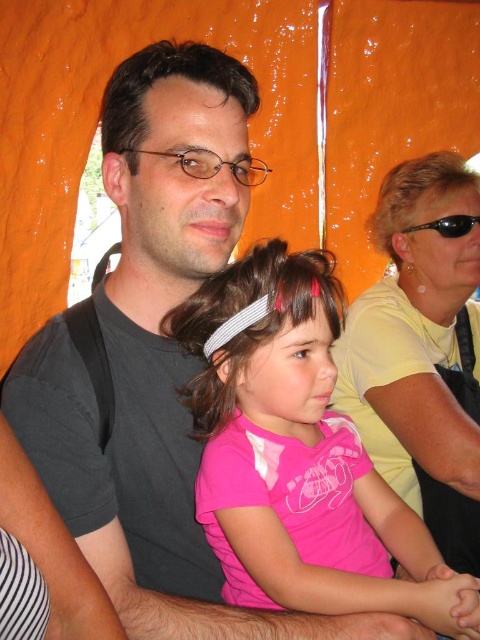
Consider the image. You are standing inside the tent and want to hand a toy to the girl wearing the pink fabric shirt at center. Based on the coordinates provided in the Objects Description, in which direction should you move relative to the orange fabric backdrop to reach her?

The pink fabric shirt at center is located at point (303, 449), which means you should move towards the lower right direction relative to the orange fabric backdrop to reach the girl.

You are standing inside the tent and want to move from the position of point (469, 221) to point (276, 541). Is the path clear of any obstacles between these two points?

Yes, the path between point (276, 541) and point (469, 221) is clear since point (276, 541) is in front of point (469, 221), indicating no obstruction between them.